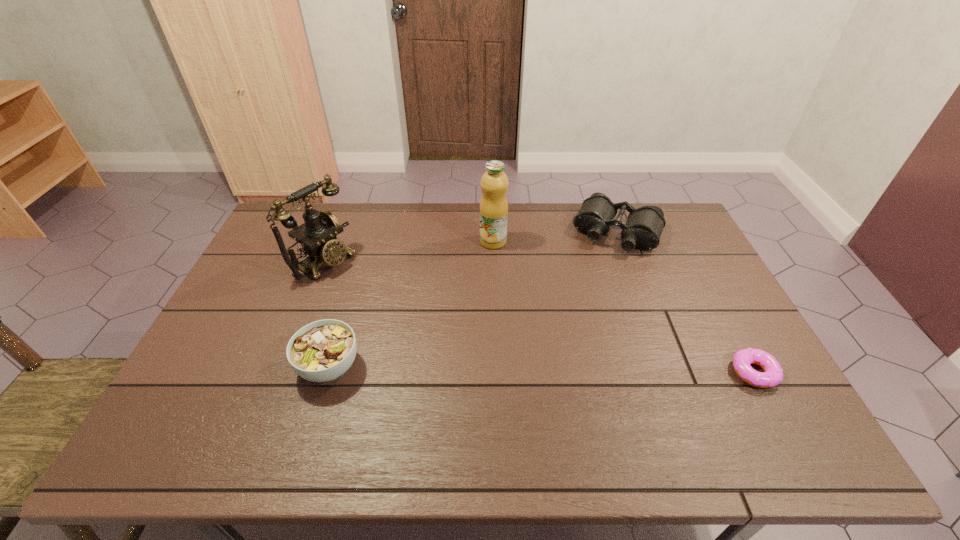
Find the location of `soup bowl`. soup bowl is located at coordinates (321, 351).

The image size is (960, 540). What are the coordinates of `the shortest object` in the screenshot? It's located at (773, 373).

Where is `binoculars`? Image resolution: width=960 pixels, height=540 pixels. binoculars is located at coordinates pyautogui.click(x=643, y=229).

The height and width of the screenshot is (540, 960). Identify the location of the third object from right to left. (494, 183).

The width and height of the screenshot is (960, 540). I want to click on telephone, so click(317, 236).

This screenshot has height=540, width=960. What are the coordinates of `free space located 0.120m on the left of the soup bowl` in the screenshot? It's located at (252, 367).

Where is `vacant space located 0.070m on the back of the shortest object`? This screenshot has width=960, height=540. vacant space located 0.070m on the back of the shortest object is located at coordinates (733, 334).

At what (x,y) coordinates should I click in order to perform the action: click on vacant area situated through the eyepieces of the binoculars. Please return your answer as a coordinate pair (x, y). The width and height of the screenshot is (960, 540). Looking at the image, I should click on (595, 275).

The height and width of the screenshot is (540, 960). In order to click on vacant space situated 0.240m through the eyepieces of the binoculars in this screenshot , I will do `click(583, 301)`.

Locate an element on the screen. This screenshot has width=960, height=540. vacant space located through the eyepieces of the binoculars is located at coordinates (586, 295).